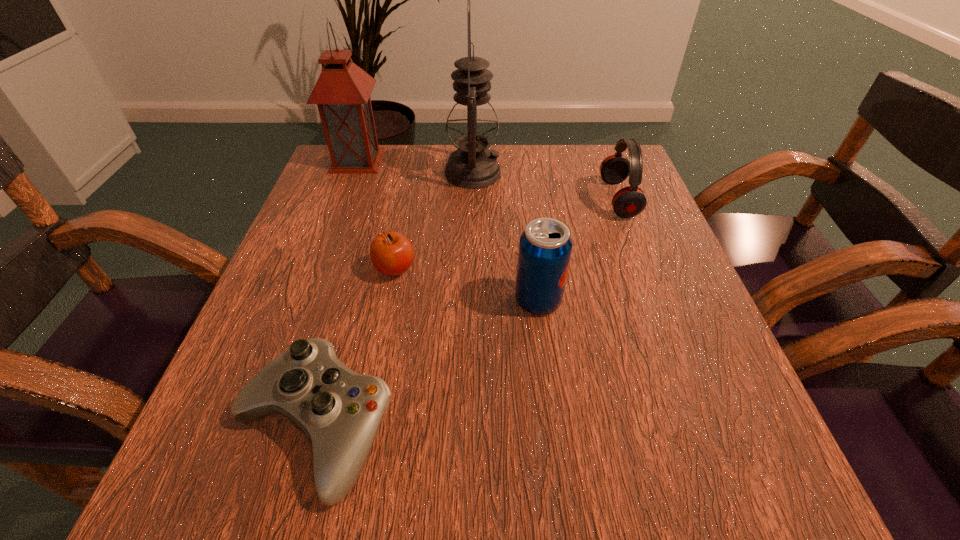
Find the location of a particular element. oil lamp is located at coordinates (472, 125).

This screenshot has height=540, width=960. Find the location of `the tallest object`. the tallest object is located at coordinates (472, 125).

Find the location of a particular element. This screenshot has width=960, height=540. the second tallest object is located at coordinates (342, 92).

I want to click on pop soda, so click(x=545, y=247).

Find the location of a particular element. The height and width of the screenshot is (540, 960). the rightmost object is located at coordinates click(x=628, y=202).

You are a GUI agent. You are given a task and a screenshot of the screen. Output one action in this format:
    pyautogui.click(x=<x>, y=<y>)
    Task: Click on the apple
    The width and height of the screenshot is (960, 540).
    Given the screenshot: What is the action you would take?
    pyautogui.click(x=391, y=253)

I want to click on control, so click(339, 411).

Locate an element on the screen. free space located on the left of the tallest object is located at coordinates (348, 173).

Image resolution: width=960 pixels, height=540 pixels. Find the location of `free space located 0.240m on the right of the second tallest object`. free space located 0.240m on the right of the second tallest object is located at coordinates (480, 160).

This screenshot has height=540, width=960. Find the location of `free region located on the back of the second object from right to left`. free region located on the back of the second object from right to left is located at coordinates (526, 207).